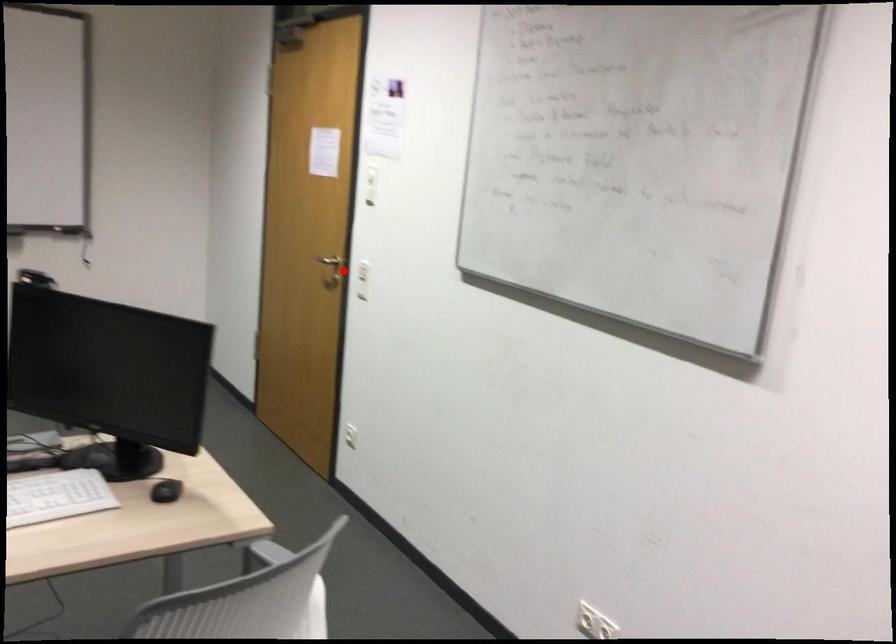
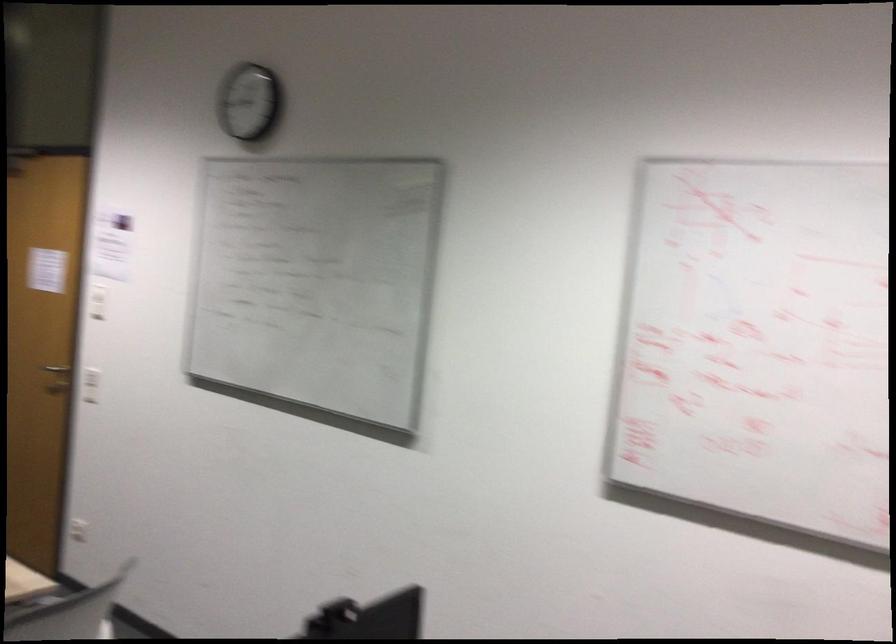
Find the pixel in the second image that matches the highlighted location in the first image.

(90, 384)